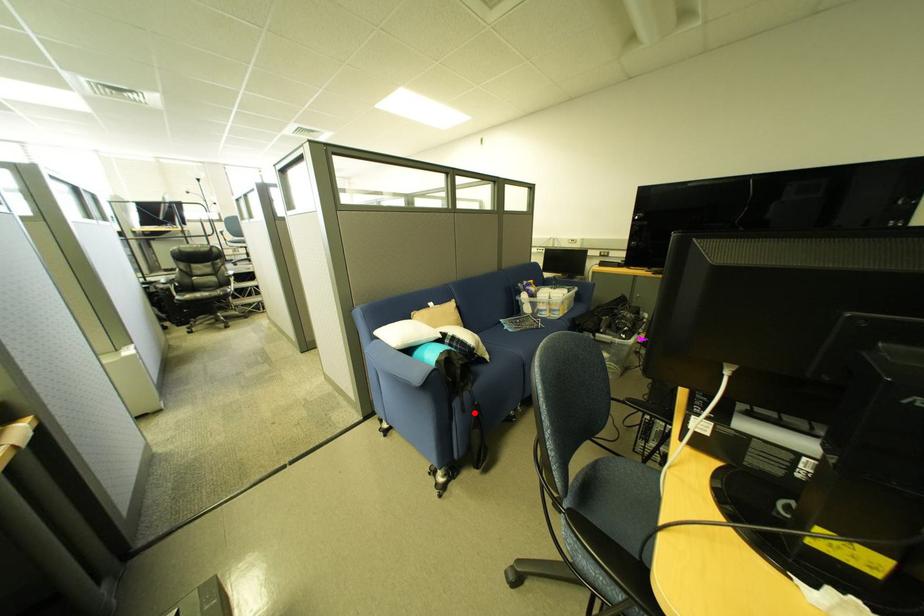
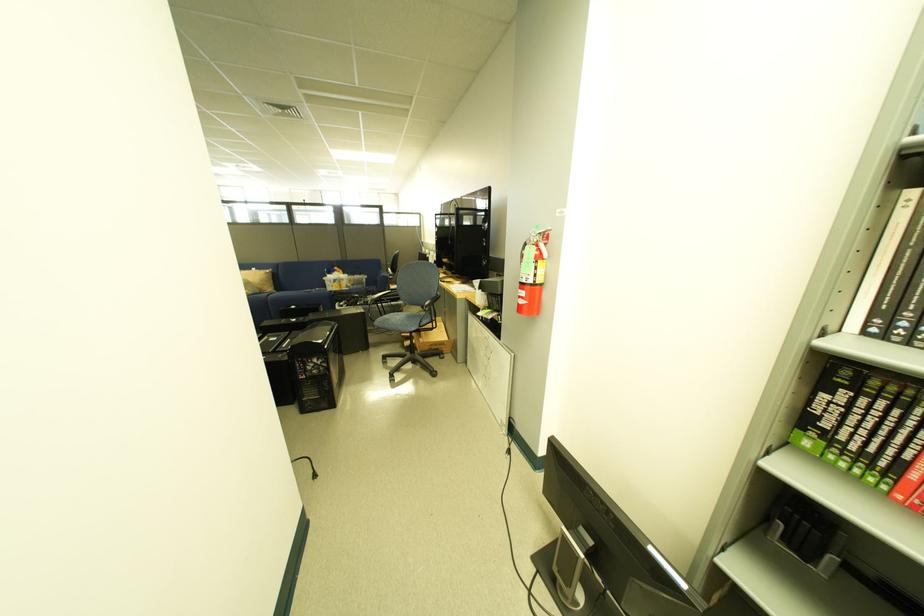
Question: I am providing you with two images of the same scene from different viewpoints. A red point is marked on the first image. Can you still see the location of the red point in image 2?

Choices:
 (A) Yes
 (B) No

Answer: (B)